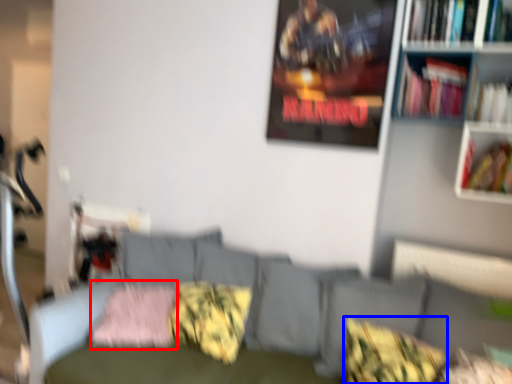
Question: Among these objects, which one is nearest to the camera, pillow (highlighted by a red box) or pillow (highlighted by a blue box)?

Choices:
 (A) pillow
 (B) pillow

Answer: (B)